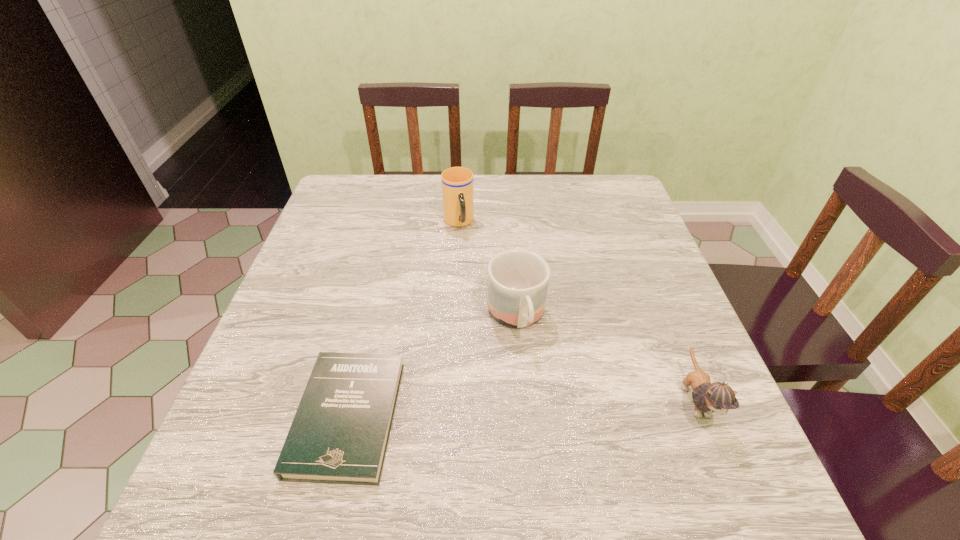
At what (x,y) coordinates should I click in order to perform the action: click on object present at the near right corner. Please return your answer as a coordinate pair (x, y). Looking at the image, I should click on (718, 397).

At what (x,y) coordinates should I click in order to perform the action: click on vacant space at the far edge. Please return your answer as a coordinate pair (x, y). This screenshot has height=540, width=960. Looking at the image, I should click on (536, 190).

The width and height of the screenshot is (960, 540). In the image, there is a desktop. Identify the location of blank space at the near edge. (484, 436).

The image size is (960, 540). I want to click on vacant space at the right edge of the desktop, so click(624, 274).

This screenshot has height=540, width=960. I want to click on vacant space in between the shortest object and the rightmost object, so click(521, 408).

Where is `unoccupied position between the second object from left to right and the rightmost object`? This screenshot has height=540, width=960. unoccupied position between the second object from left to right and the rightmost object is located at coordinates (577, 311).

Find the location of a particular element. This screenshot has height=540, width=960. free space between the kitten and the shortest object is located at coordinates (521, 408).

At what (x,y) coordinates should I click in order to perform the action: click on free space between the mug and the shortest object. Please return your answer as a coordinate pair (x, y). Looking at the image, I should click on (432, 367).

Where is `free space between the kitten and the book`? The height and width of the screenshot is (540, 960). free space between the kitten and the book is located at coordinates (521, 408).

Where is `vacant area that lies between the cup and the leftmost object`? This screenshot has height=540, width=960. vacant area that lies between the cup and the leftmost object is located at coordinates (403, 320).